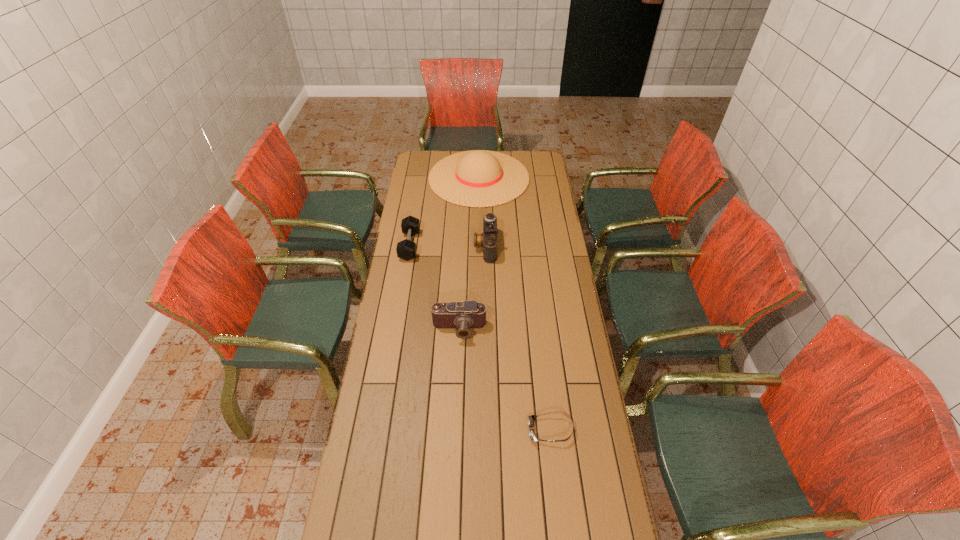
The height and width of the screenshot is (540, 960). I want to click on free location that satisfies the following two spatial constraints: 1. on the lens of the farther camera; 2. on the front-facing side of the fourth farthest object, so click(x=488, y=329).

Find the location of a particular element. This screenshot has height=540, width=960. free space that satisfies the following two spatial constraints: 1. on the lens of the farther camera; 2. on the front-facing side of the fourth farthest object is located at coordinates (488, 329).